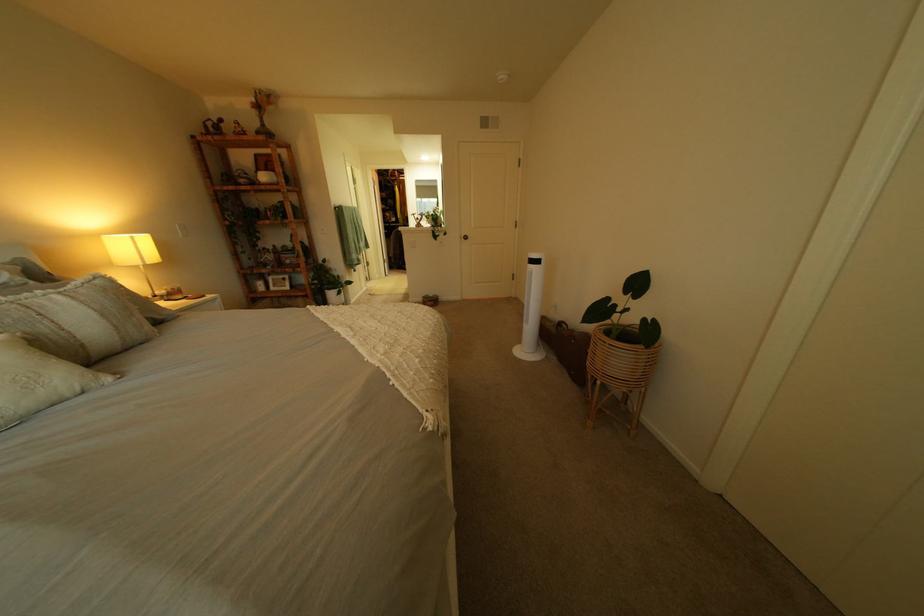
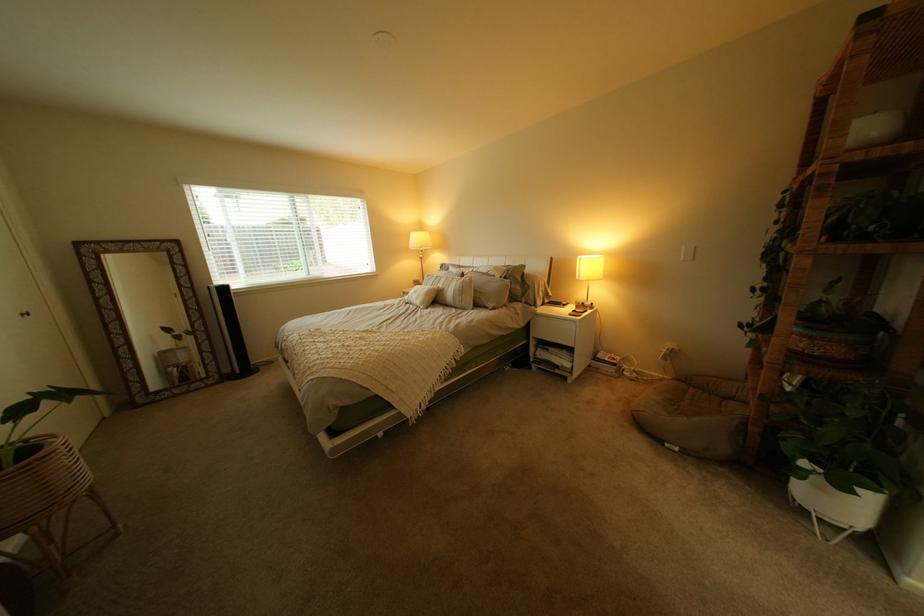
The point at (x=113, y=283) is marked in the first image. Where is the corresponding point in the second image?

(482, 280)